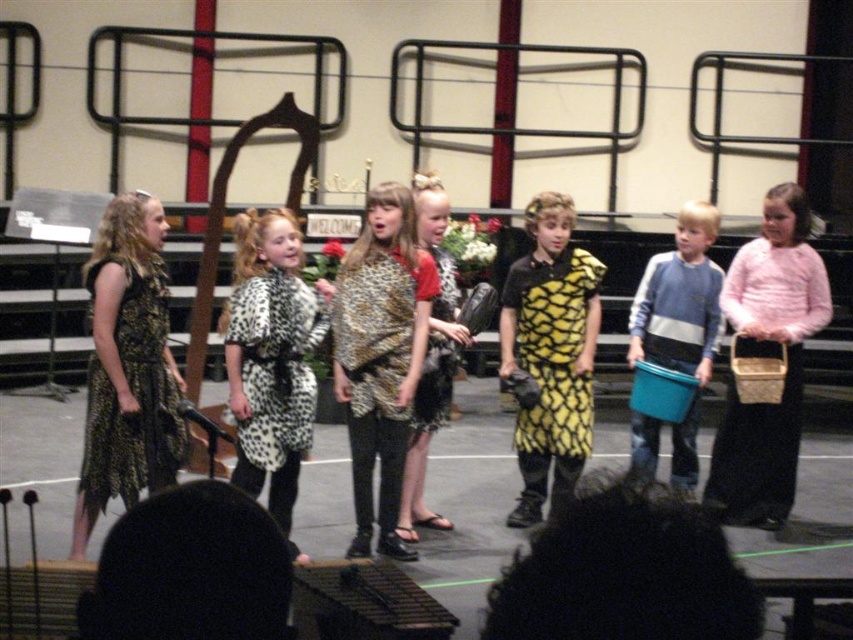
You are a photographer standing at the camera position. You want to capture a closeup shot of the leopard print scarf at center. Given that your camera can focus on objects within 10 feet, will you be able to take the closeup shot?

The leopard print scarf at center is 15.42 feet from the camera, which is beyond the camera focus range of 10 feet. Therefore, you cannot take the closeup shot.

You are a photographer taking pictures of the leopard print scarf at center and the printed leopard dress at center during the school play. Which one should you focus on first to ensure it appears larger in the photo?

The leopard print scarf at center is closer to the viewer than the printed leopard dress at center, so focusing on it first will make it appear larger in the photo.

You are a stagehand preparing to move the blue plastic bucket at center and the leopard print fabric shawl at center closer together for the next scene. How much distance do you need to reduce between them to make them touch?

The blue plastic bucket at center and leopard print fabric shawl at center are currently 1.88 meters apart. To make them touch, you need to reduce the distance between them by 1.88 meters.